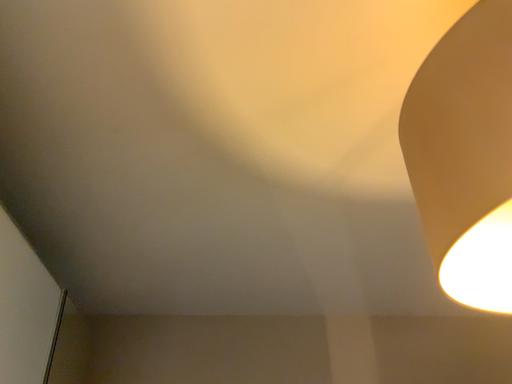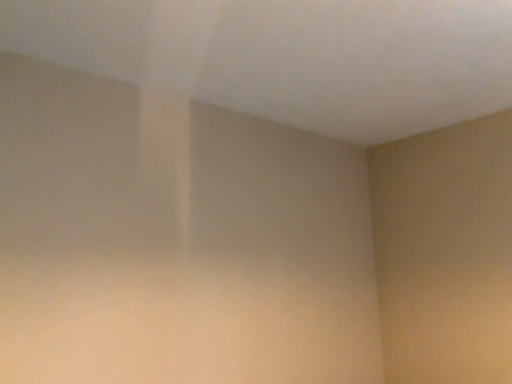
Question: Which way did the camera rotate in the video?

Choices:
 (A) rotated right
 (B) rotated left

Answer: (A)